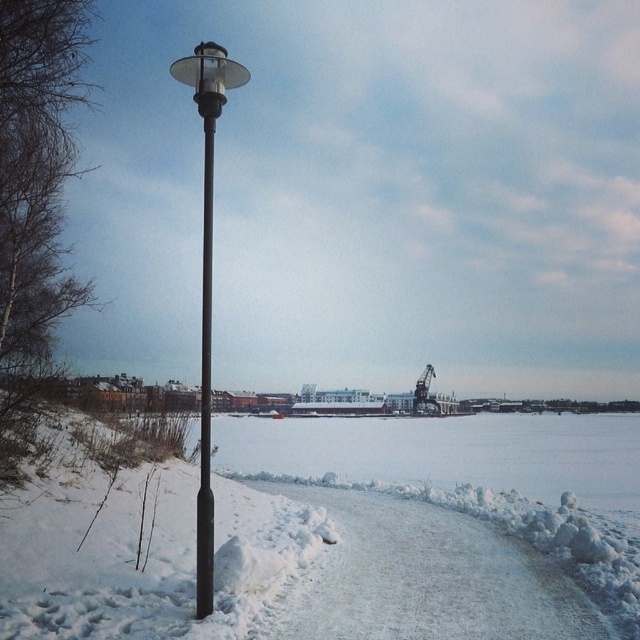
Who is taller, black matte pole at center or black smooth pole at center?

black matte pole at center is taller.

Can you confirm if black matte pole at center is positioned below black smooth pole at center?

No, black matte pole at center is not below black smooth pole at center.

Locate an element on the screen. The height and width of the screenshot is (640, 640). black matte pole at center is located at coordinates (205, 280).

You are a GUI agent. You are given a task and a screenshot of the screen. Output one action in this format:
    pyautogui.click(x=<x>, y=<y>)
    Task: Click on the black matte pole at center
    The image size is (640, 640).
    Given the screenshot: What is the action you would take?
    pyautogui.click(x=205, y=280)

Who is positioned more to the right, white fluffy snow at center or black matte pole at center?

From the viewer's perspective, white fluffy snow at center appears more on the right side.

How distant is white fluffy snow at center from black matte pole at center?

white fluffy snow at center is 7.53 meters away from black matte pole at center.

Between point (506, 554) and point (205, 429), which one is positioned in front?

Point (205, 429) is more forward.

Identify the location of white fluffy snow at center. (269, 564).

Consider the image. Can you confirm if white fluffy snow at center is positioned below black smooth pole at center?

Indeed, white fluffy snow at center is positioned under black smooth pole at center.

Looking at this image, who is more forward, (278, 460) or (208, 614)?

Positioned in front is point (208, 614).

Who is more forward, (301, 579) or (212, 129)?

Point (212, 129) is more forward.

This screenshot has width=640, height=640. Find the location of `white fluffy snow at center`. white fluffy snow at center is located at coordinates (269, 564).